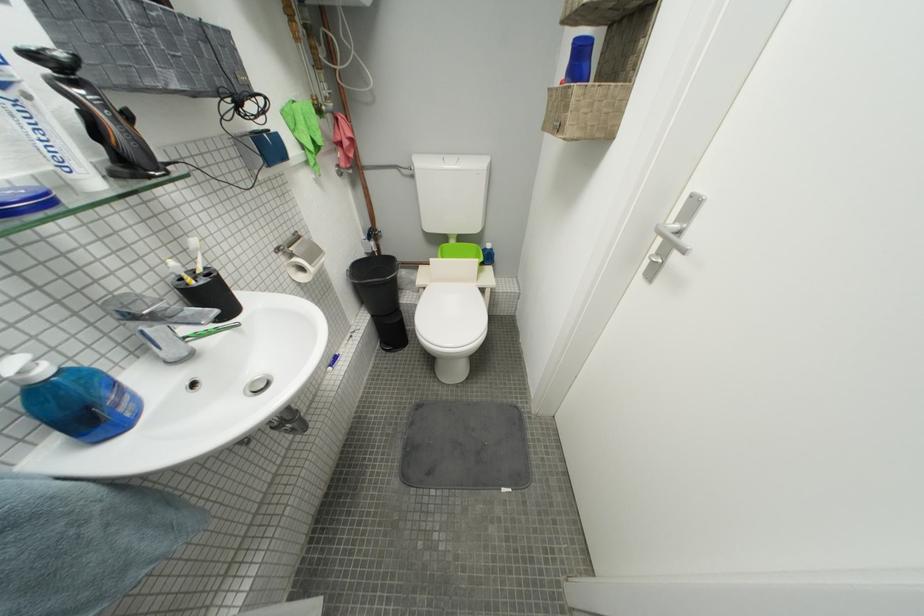
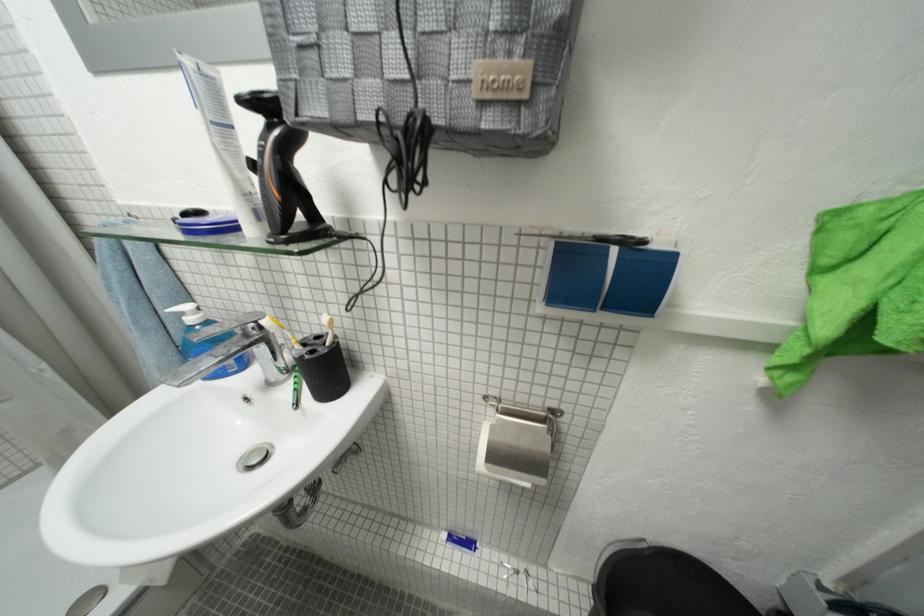
The first image is from the beginning of the video and the second image is from the end. How did the camera likely rotate when shooting the video?

The camera rotated toward left-down.